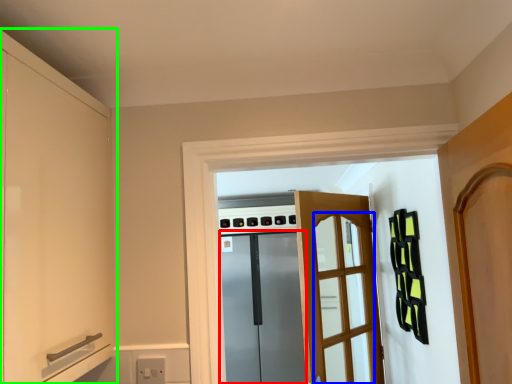
Question: Estimate the real-world distances between objects in this image. Which object is closer to screen door (highlighted by a red box), screen door (highlighted by a blue box) or cabinetry (highlighted by a green box)?

Choices:
 (A) screen door
 (B) cabinetry

Answer: (A)